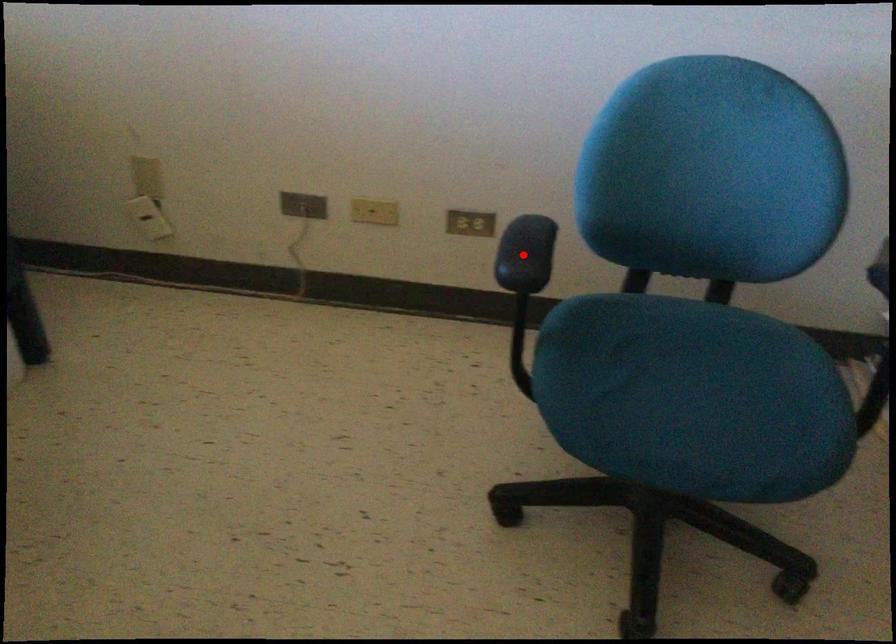
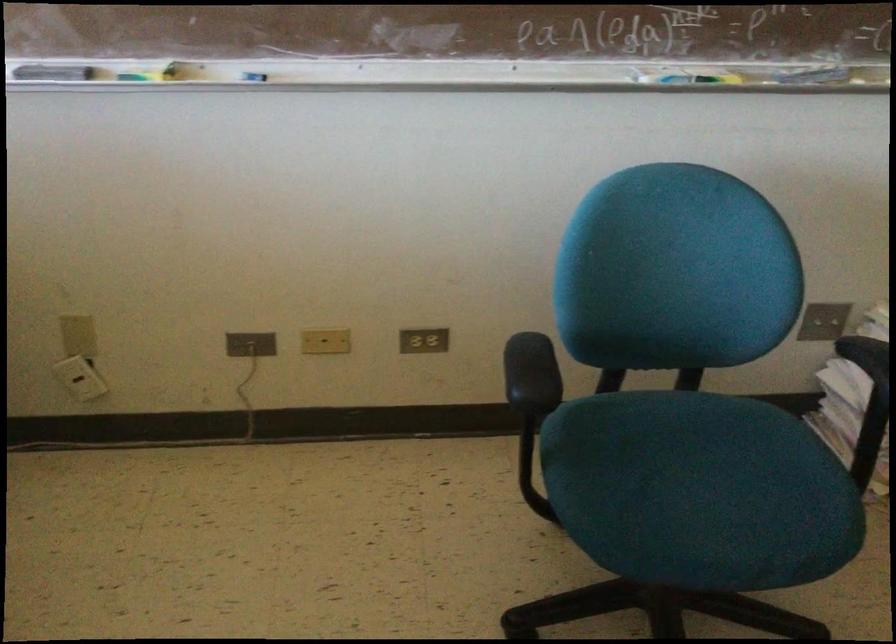
Where in the second image is the point corresponding to the highlighted location from the first image?

(531, 374)